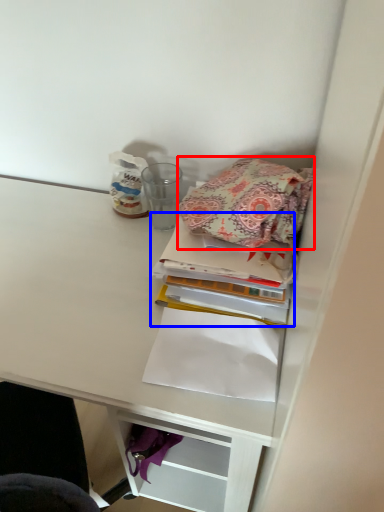
Question: Which object is further to the camera taking this photo, cloth (highlighted by a red box) or book (highlighted by a blue box)?

Choices:
 (A) cloth
 (B) book

Answer: (B)